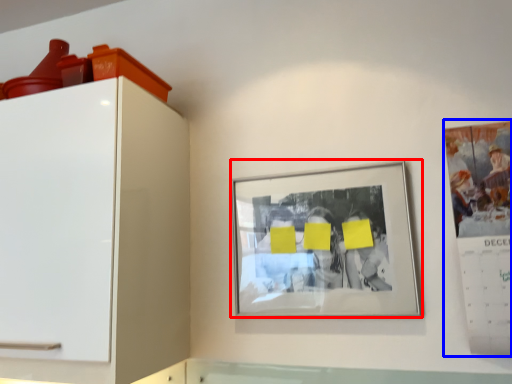
Question: Which object appears closest to the camera in this image, picture frame (highlighted by a red box) or poster (highlighted by a blue box)?

Choices:
 (A) picture frame
 (B) poster

Answer: (B)